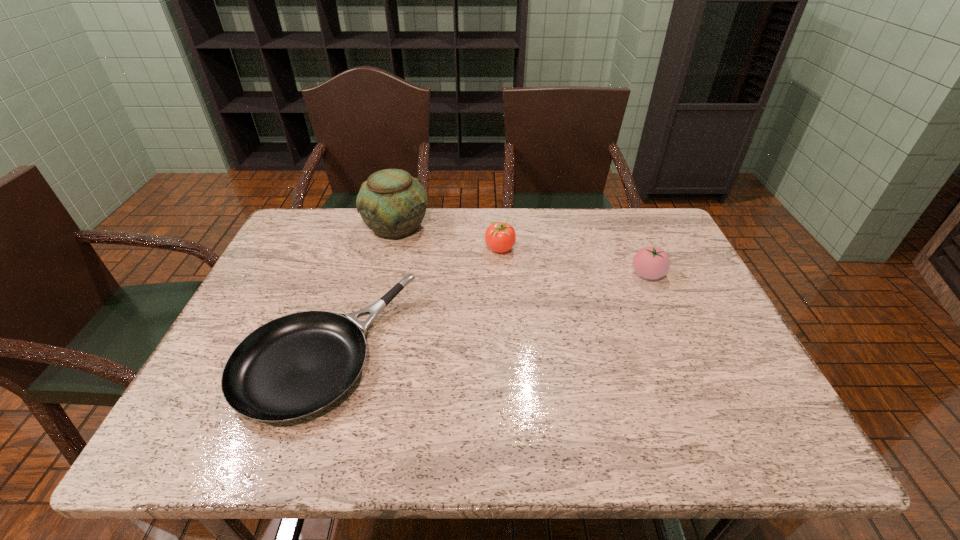
Image resolution: width=960 pixels, height=540 pixels. Identify the location of the tallest object. (392, 203).

You are a GUI agent. You are given a task and a screenshot of the screen. Output one action in this format:
    pyautogui.click(x=<x>, y=<y>)
    Task: Click on the left tomato
    
    Given the screenshot: What is the action you would take?
    pyautogui.click(x=500, y=237)

This screenshot has height=540, width=960. I want to click on the farther tomato, so click(500, 237).

This screenshot has height=540, width=960. What are the coordinates of `the right tomato` in the screenshot? It's located at (650, 262).

Identify the location of the second nearest object. (650, 262).

I want to click on pan, so click(x=294, y=366).

Find the location of `the nearest object`. the nearest object is located at coordinates (294, 366).

Where is `free spot located on the front of the pottery`? free spot located on the front of the pottery is located at coordinates (370, 333).

This screenshot has height=540, width=960. I want to click on blank area located on the right of the second object from right to left, so click(x=608, y=248).

You are a GUI agent. You are given a task and a screenshot of the screen. Output one action in this format:
    pyautogui.click(x=<x>, y=<y>)
    Task: Click on the free space located 0.330m on the left of the second nearest object
    
    Given the screenshot: What is the action you would take?
    pyautogui.click(x=511, y=274)